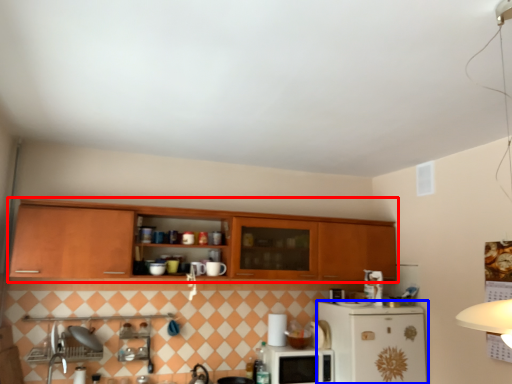
Question: Which object is further to the camera taking this photo, cabinetry (highlighted by a red box) or refrigerator (highlighted by a blue box)?

Choices:
 (A) cabinetry
 (B) refrigerator

Answer: (B)